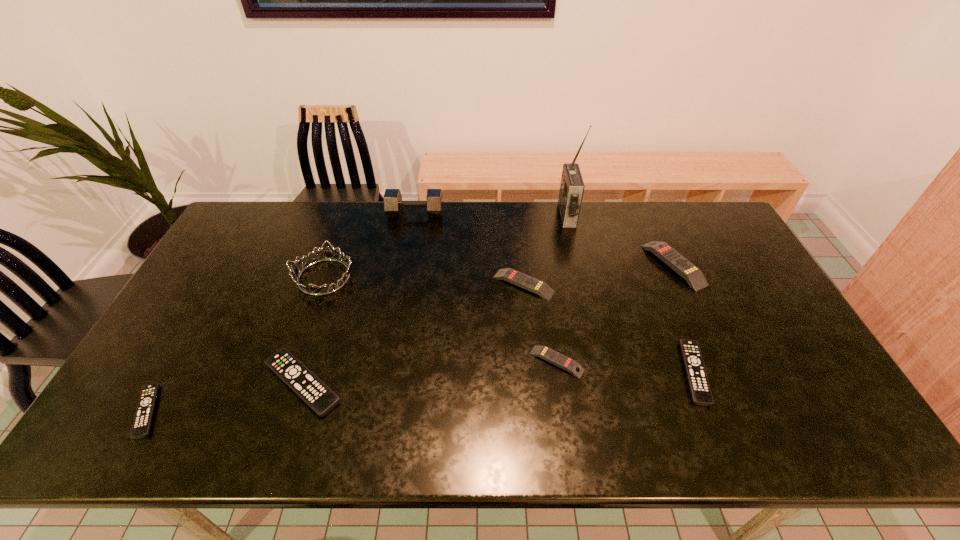
Locate an element on the screen. vacant space at the far edge of the desktop is located at coordinates (603, 222).

The image size is (960, 540). Find the location of `vacant space at the near edge of the desktop`. vacant space at the near edge of the desktop is located at coordinates (614, 443).

Identify the location of free point at the right edge. Image resolution: width=960 pixels, height=540 pixels. [x=761, y=309].

You are a GUI agent. You are given a task and a screenshot of the screen. Output one action in this format:
    pyautogui.click(x=<x>, y=<y>)
    Task: Click on the vacant space at the far right corner
    
    Given the screenshot: What is the action you would take?
    pyautogui.click(x=690, y=238)

Identify the location of unoccupied position between the nearest yellow remote control and the eighth shortest object. The height and width of the screenshot is (540, 960). (486, 287).

At what (x,y) coordinates should I click in order to perform the action: click on vacant space in between the dumbbell and the rightmost yellow remote control. Please return your answer as a coordinate pair (x, y). This screenshot has height=540, width=960. Looking at the image, I should click on (544, 239).

I want to click on free spot between the biggest yellow remote control and the second smallest yellow remote control, so click(598, 275).

At what (x,y) coordinates should I click in order to perform the action: click on vacant area that lies between the radio receiver and the seventh shortest object. Please return your answer as a coordinate pair (x, y). Looking at the image, I should click on (445, 246).

The image size is (960, 540). Find the location of `free space between the second smallest black remote control and the seventh shortest object`. free space between the second smallest black remote control and the seventh shortest object is located at coordinates (509, 325).

Find the location of a particular element. This screenshot has height=540, width=960. vacant point located between the dumbbell and the tallest object is located at coordinates coord(492,214).